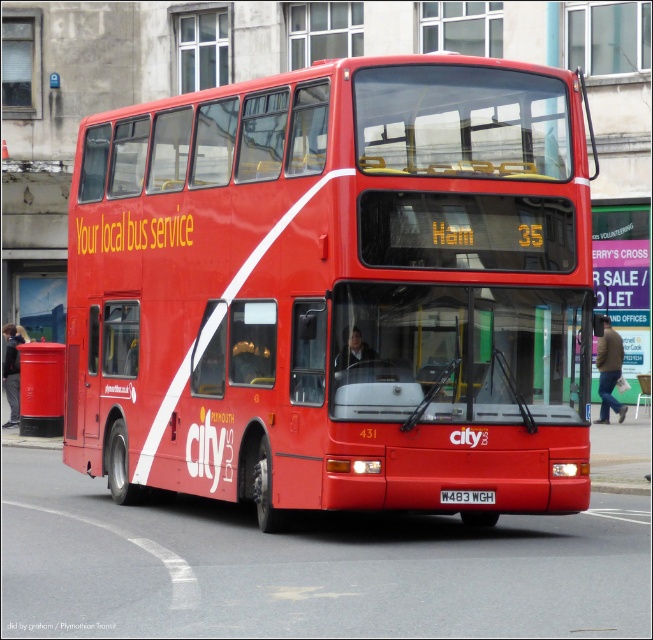
Question: Among these objects, which one is nearest to the camera?

Choices:
 (A) metallic red postbox at lower left
 (B) matte red bus at center
 (C) white plastic license plate at center

Answer: (C)

Question: Is metallic red postbox at lower left smaller than white plastic license plate at center?

Choices:
 (A) no
 (B) yes

Answer: (A)

Question: Is matte red bus at center positioned behind metallic red postbox at lower left?

Choices:
 (A) no
 (B) yes

Answer: (A)

Question: Which point is closer to the camera?

Choices:
 (A) matte red bus at center
 (B) metallic red postbox at lower left
 (C) white plastic license plate at center

Answer: (C)

Question: Estimate the real-world distances between objects in this image. Which object is closer to the metallic red postbox at lower left?

Choices:
 (A) white plastic license plate at center
 (B) matte red bus at center

Answer: (A)

Question: Is metallic red postbox at lower left thinner than white plastic license plate at center?

Choices:
 (A) no
 (B) yes

Answer: (A)